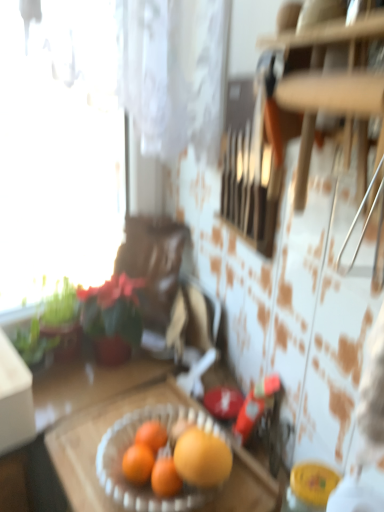
Question: Should I look upward or downward to see clear glass bowl at center?

Choices:
 (A) down
 (B) up

Answer: (A)